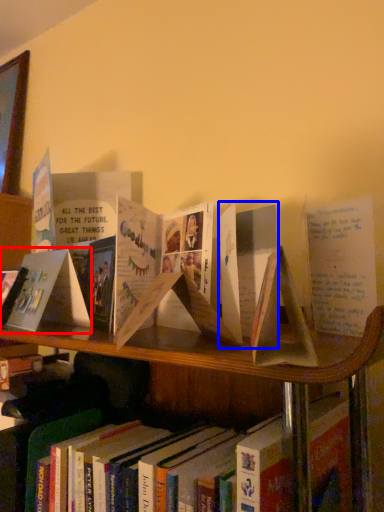
Question: Among these objects, which one is farthest to the camera, paperback book (highlighted by a red box) or paperback book (highlighted by a blue box)?

Choices:
 (A) paperback book
 (B) paperback book

Answer: (A)